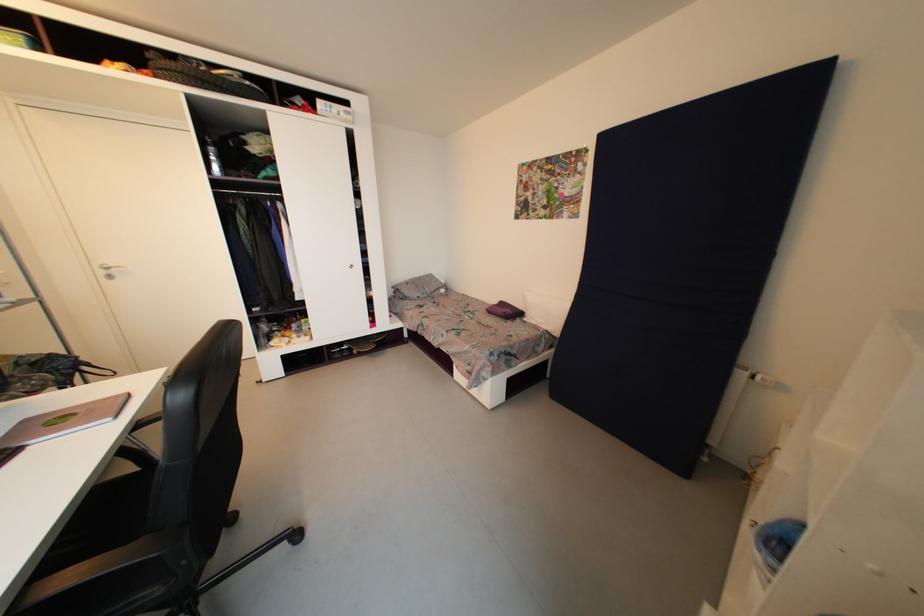
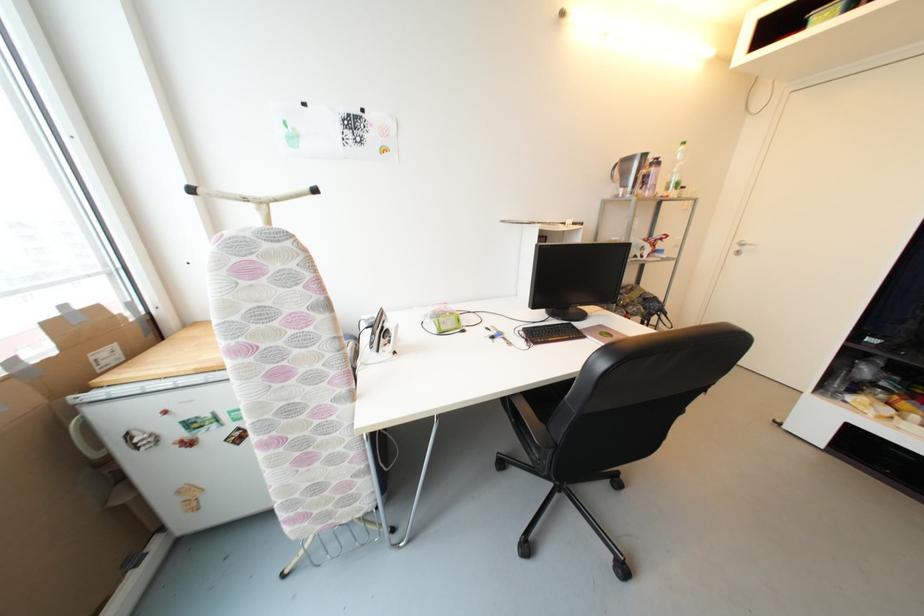
The images are taken continuously from a first-person perspective. In which direction is your viewpoint rotating?

The rotation direction of the camera is left-down.